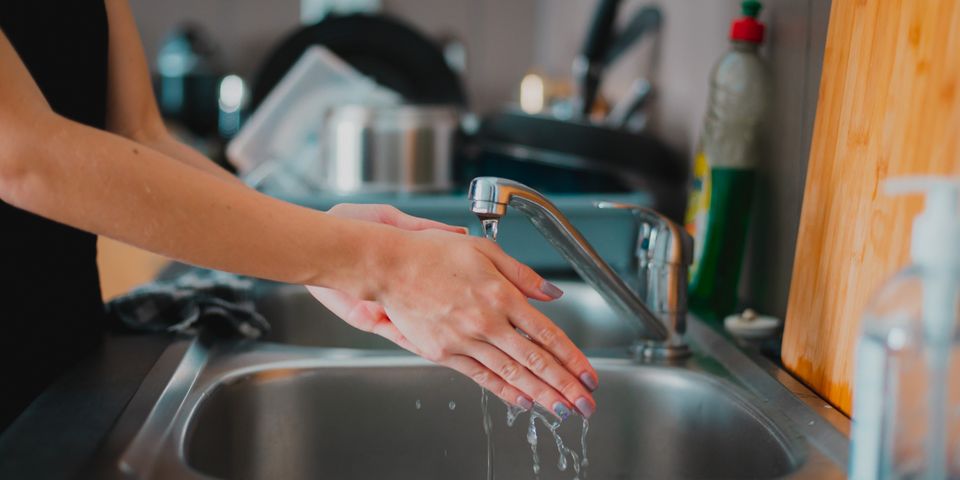
Find the location of `frying pan`. frying pan is located at coordinates (573, 138).